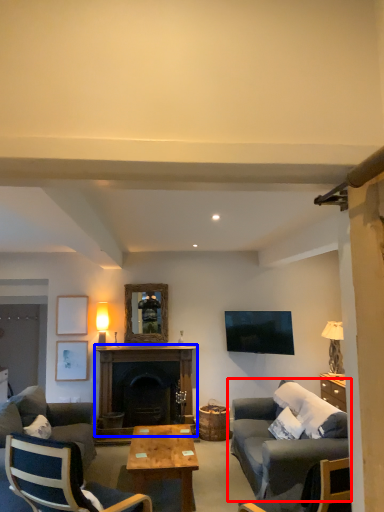
Question: Among these objects, which one is farthest to the camera, studio couch (highlighted by a red box) or fireplace (highlighted by a blue box)?

Choices:
 (A) studio couch
 (B) fireplace

Answer: (B)